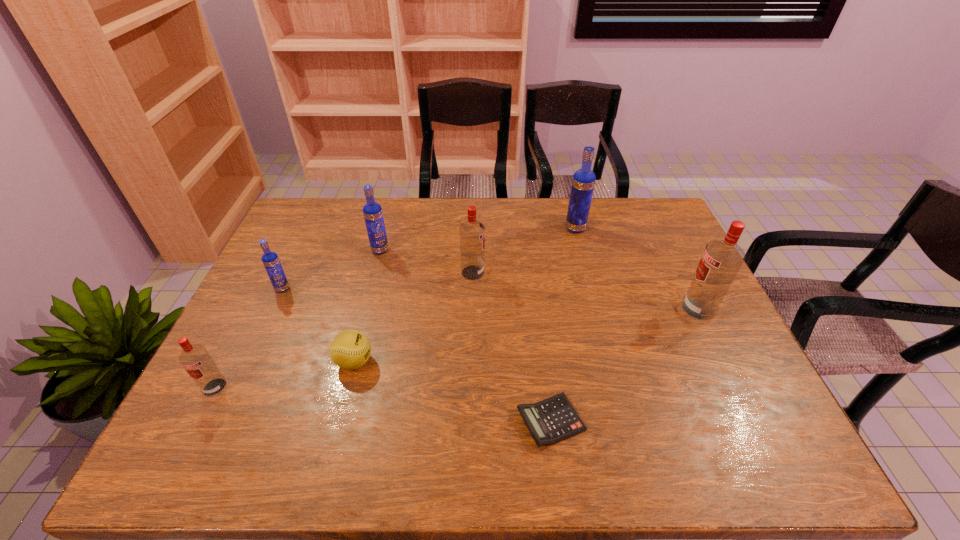
What are the coordinates of `the nearest red vodka` in the screenshot? It's located at (195, 359).

Identify the location of the smallest red vodka. The image size is (960, 540). (195, 359).

The width and height of the screenshot is (960, 540). What are the coordinates of `yellow softball` in the screenshot? It's located at (350, 349).

Image resolution: width=960 pixels, height=540 pixels. Identify the location of the second shortest object. (350, 349).

The height and width of the screenshot is (540, 960). Identify the location of calculator. (550, 421).

Where is `the shortest object`? This screenshot has width=960, height=540. the shortest object is located at coordinates (550, 421).

Where is `free space located 0.060m on the left of the seventh object from left to right`? This screenshot has height=540, width=960. free space located 0.060m on the left of the seventh object from left to right is located at coordinates (548, 228).

Locate an element on the screen. The image size is (960, 540). vacant region located on the front label of the rightmost object is located at coordinates (608, 309).

Where is `vacant space located 0.300m on the front label of the rightmost object`? This screenshot has width=960, height=540. vacant space located 0.300m on the front label of the rightmost object is located at coordinates (576, 309).

Locate an element on the screen. The height and width of the screenshot is (540, 960). vacant space situated on the front label of the rightmost object is located at coordinates (654, 309).